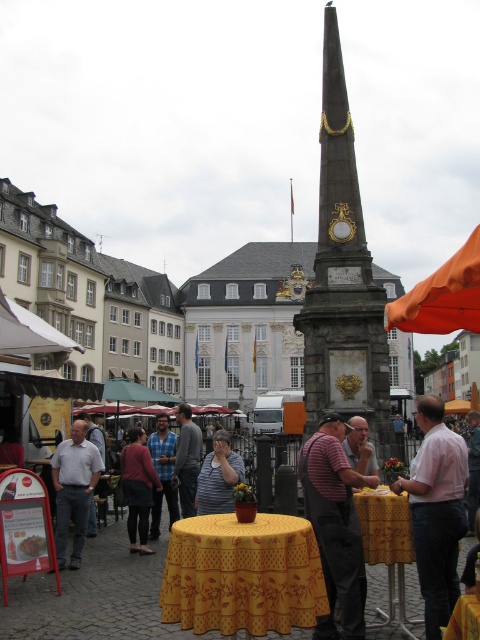
Question: Is blue striped shirt at center to the right of matte black shirt at center from the viewer's perspective?

Choices:
 (A) yes
 (B) no

Answer: (B)

Question: Which point is farther to the camera?

Choices:
 (A) (336, 362)
 (B) (192, 458)
 (C) (201, 493)

Answer: (B)

Question: Which point appears closest to the camera in this image?

Choices:
 (A) (134, 481)
 (B) (183, 440)
 (C) (177, 506)
 (D) (199, 577)

Answer: (D)

Question: Is striped shirt at center to the right of gray sweater at center from the viewer's perspective?

Choices:
 (A) yes
 (B) no

Answer: (A)

Question: Which of the following is the closest to the observer?

Choices:
 (A) (346, 506)
 (B) (391, 604)
 (C) (144, 520)

Answer: (B)

Question: Is dark gray stone obelisk at center wider than striped shirt at center?

Choices:
 (A) no
 (B) yes

Answer: (B)